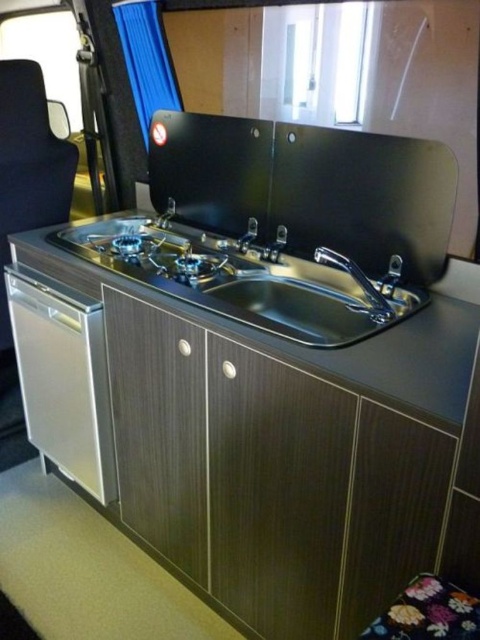
From the picture: Who is more distant from viewer, (74, 477) or (83, 246)?

Point (74, 477)

Who is positioned more to the left, satin silver oven at lower left or stainless steel gas stove at center?

Positioned to the left is satin silver oven at lower left.

This screenshot has height=640, width=480. I want to click on satin silver oven at lower left, so click(63, 378).

Does point (420, 364) lie behind point (372, 308)?

That is False.

Can you confirm if satin black countertop at center is wider than polished stainless steel faucet at center?

Correct, the width of satin black countertop at center exceeds that of polished stainless steel faucet at center.

Which is in front, point (447, 419) or point (374, 314)?

Point (447, 419) is more forward.

Locate an element on the screen. satin black countertop at center is located at coordinates (331, 339).

Does satin black countertop at center have a lesser width compared to satin nickel faucet at center?

Incorrect, satin black countertop at center's width is not less than satin nickel faucet at center's.

Is satin black countertop at center taller than satin nickel faucet at center?

Indeed, satin black countertop at center has a greater height compared to satin nickel faucet at center.

Between point (466, 275) and point (156, 220), which one is positioned in front?

Positioned in front is point (466, 275).

Where is `satin black countertop at center`? The width and height of the screenshot is (480, 640). satin black countertop at center is located at coordinates tap(331, 339).